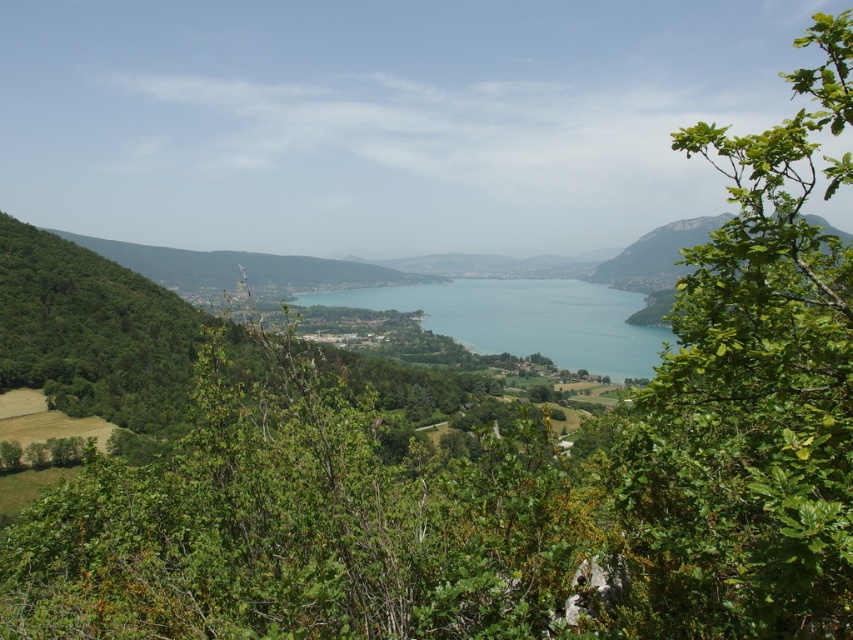
Question: Among these objects, which one is farthest from the camera?

Choices:
 (A) green leafy tree at right
 (B) green leafy tree at center

Answer: (B)

Question: Can you confirm if green leafy tree at right is positioned above blue water at center?

Choices:
 (A) yes
 (B) no

Answer: (A)

Question: Is green leafy tree at center to the left of green leafy tree at right from the viewer's perspective?

Choices:
 (A) no
 (B) yes

Answer: (B)

Question: Which point is farther to the camera?

Choices:
 (A) (708, 358)
 (B) (389, 561)
 (C) (523, 352)

Answer: (C)

Question: Is green leafy tree at right closer to the viewer compared to blue water at center?

Choices:
 (A) no
 (B) yes

Answer: (B)

Question: Which object is closer to the camera taking this photo?

Choices:
 (A) green leafy tree at right
 (B) blue water at center
 (C) green leafy tree at center

Answer: (A)